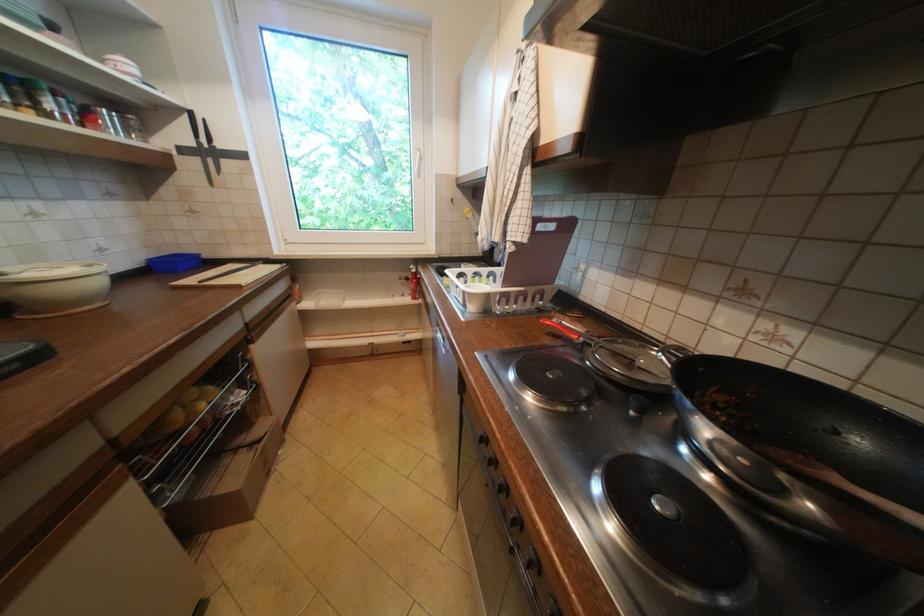
At what (x,y) coordinates should I click in order to perform the action: click on red spray bottle. Please return your answer as a coordinate pair (x, y). The height and width of the screenshot is (616, 924). Looking at the image, I should click on (412, 283).